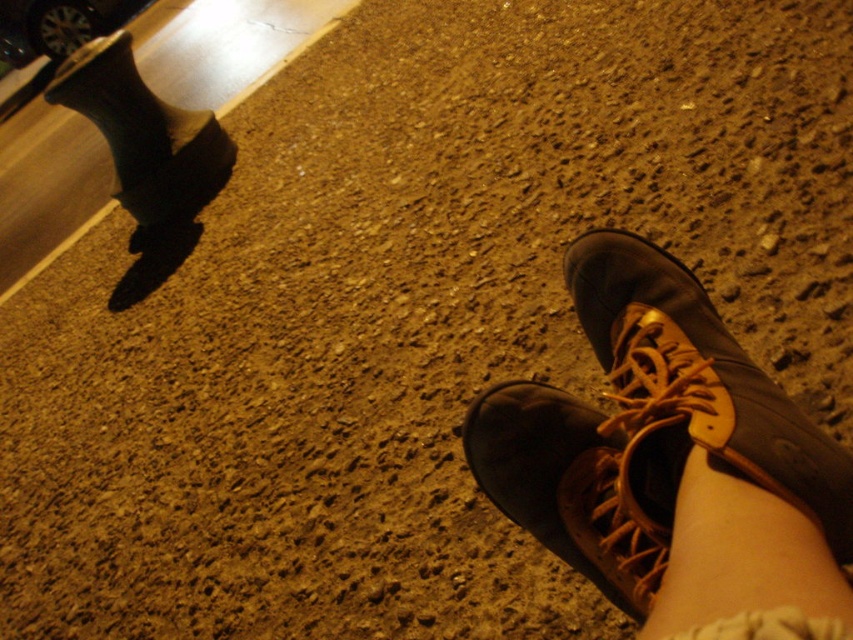
Does black rubber curb at upper left have a lesser width compared to shiny chrome car at upper left?

Incorrect, black rubber curb at upper left's width is not less than shiny chrome car at upper left's.

Who is more distant from viewer, (254, 44) or (70, 3)?

The point (70, 3) is behind.

Does point (97, 140) come farther from viewer compared to point (55, 22)?

No, it is not.

Where is `black rubber curb at upper left`? This screenshot has width=853, height=640. black rubber curb at upper left is located at coordinates (225, 45).

Who is more distant from viewer, [653,515] or [776,632]?

Point [653,515]

Who is more forward, [695,316] or [733,627]?

Point [733,627] is more forward.

The height and width of the screenshot is (640, 853). Identify the location of brown leather shoe at lower right. (712, 369).

Is the position of black rubber curb at upper left less distant than that of brown leather boot at lower right?

That is False.

Who is more distant from viewer, (315, 24) or (554, 538)?

The point (315, 24) is behind.

Is point (51, 204) positioned in front of point (473, 465)?

No, (51, 204) is behind (473, 465).

The width and height of the screenshot is (853, 640). Identify the location of black rubber curb at upper left. (225, 45).